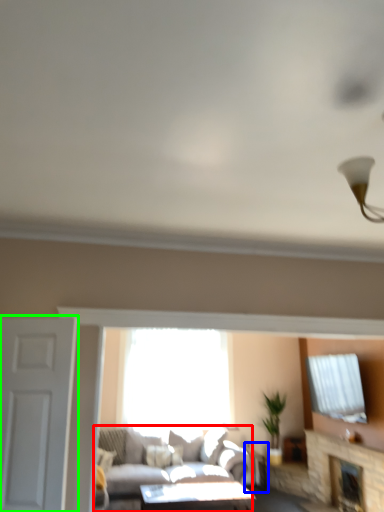
Question: Which object is the farthest from studio couch (highlighted by a red box)? Choose among these: side table (highlighted by a blue box) or door (highlighted by a green box).

Choices:
 (A) side table
 (B) door

Answer: (B)